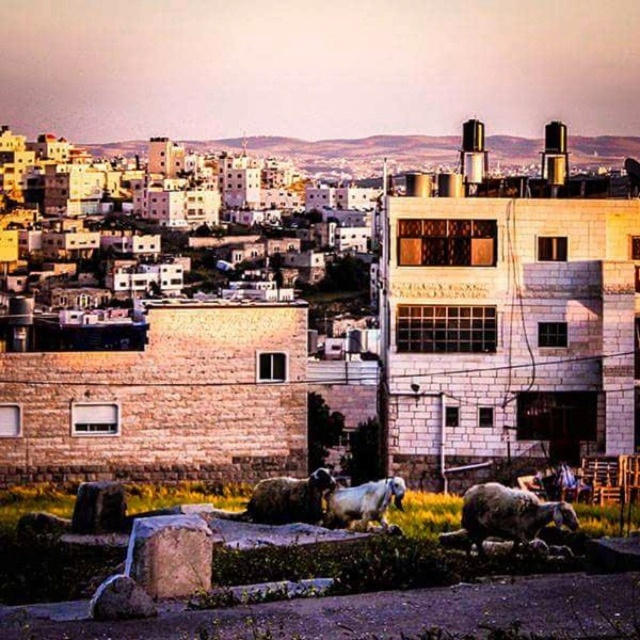
You are a farmer who needs to separate two groups of sheep using a fence. You have a 5 meter long fence panel. The two groups are the white woolen sheep at lower right and the white woolen sheep at lower center. Can you place the fence between them to separate the two groups?

The white woolen sheep at lower right and white woolen sheep at lower center are 4.61 meters apart. Since the fence panel is 5 meters long, it is long enough to span the distance between them, allowing you to place the fence between the two groups to separate them.

You are a photographer trying to capture both the brown woolen sheep at center and the white woolen sheep at lower center in a single shot. Which sheep will appear smaller in the photo?

The brown woolen sheep at center will appear smaller in the photo because it occupies less space than the white woolen sheep at lower center.

You are a photographer trying to capture both the white woolen sheep at lower right and the white woolen sheep at lower center in a single frame. Which sheep should you position closer to the left side of your camera viewfinder to ensure both are visible?

You should position the white woolen sheep at lower center closer to the left side of your camera viewfinder because the white woolen sheep at lower right is to its right side, so placing the lower center sheep to the left will allow both to fit within the frame.